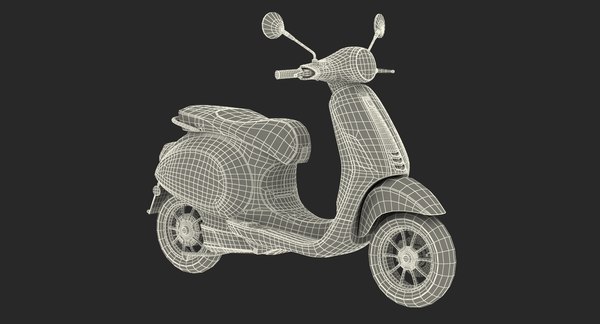
Find the location of a particular element. This screenshot has width=600, height=324. foot rest is located at coordinates (286, 236).